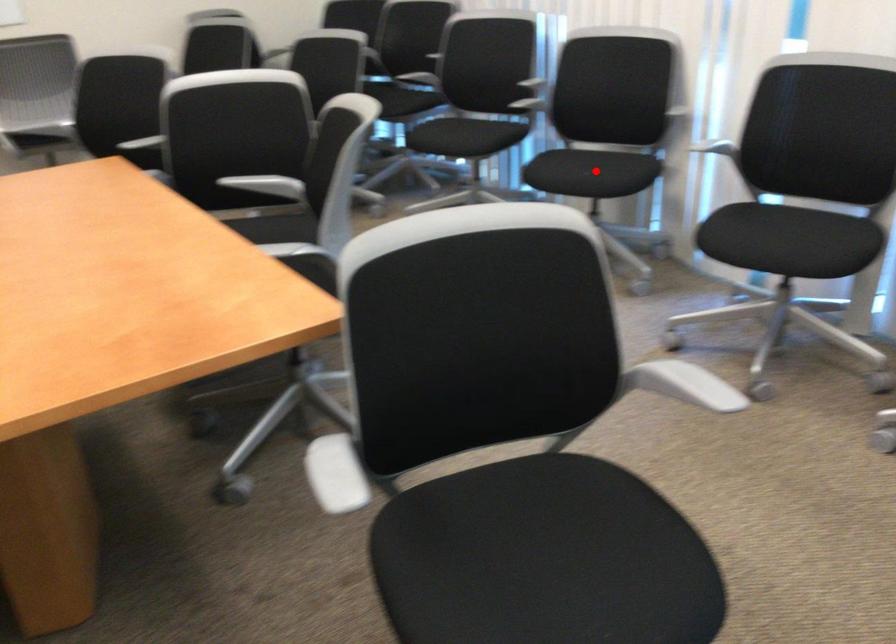
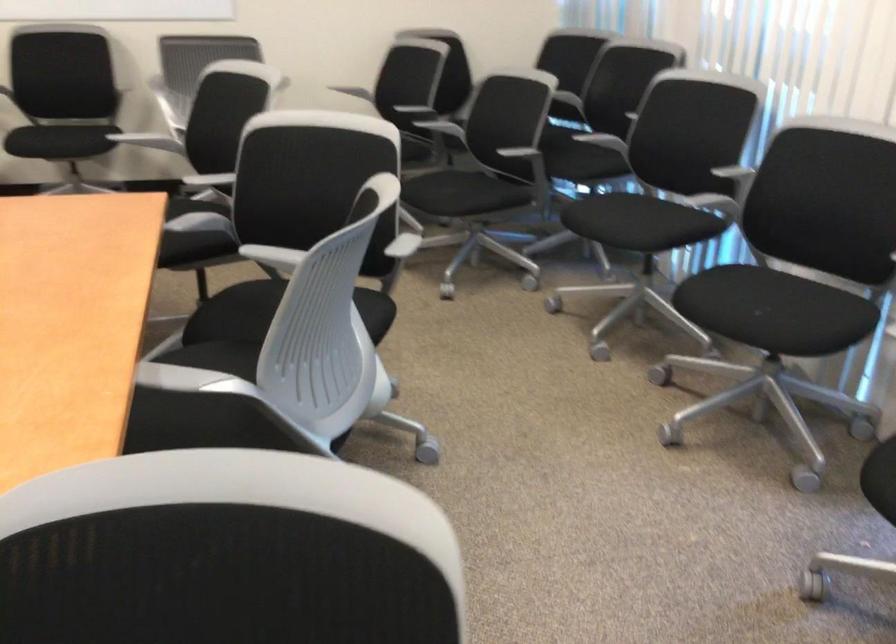
Question: I am providing you with two images of the same scene from different viewpoints. Image1 has a red point marked. In image2, the corresponding 3D location appears at what relative position? Reply with the corresponding letter.

Choices:
 (A) Closer
 (B) Farther

Answer: (A)